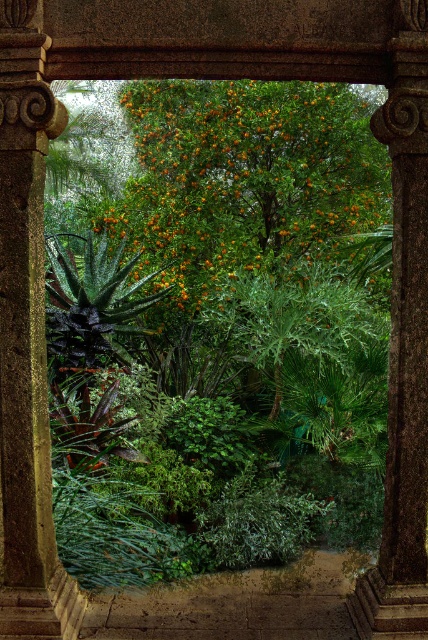
Does green leafy orange tree at center lie in front of smooth stone column at left?

No, it is behind smooth stone column at left.

Does green leafy orange tree at center have a greater height compared to smooth stone column at left?

No, green leafy orange tree at center is not taller than smooth stone column at left.

Image resolution: width=428 pixels, height=640 pixels. Find the location of `green leafy orange tree at center`. green leafy orange tree at center is located at coordinates (243, 179).

Where is `green leafy orange tree at center`? The image size is (428, 640). green leafy orange tree at center is located at coordinates (243, 179).